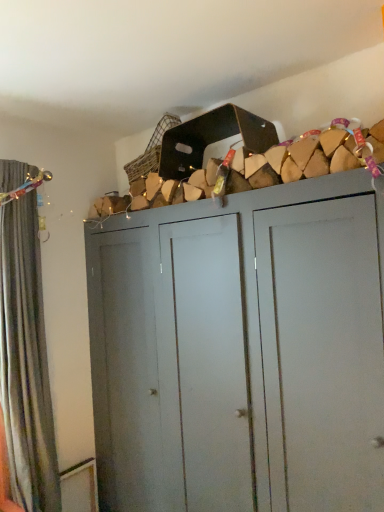
Question: Considering the relative positions of matte gray cupboard at center and velvet dark grey curtain at left in the image provided, is matte gray cupboard at center to the right of velvet dark grey curtain at left from the viewer's perspective?

Choices:
 (A) no
 (B) yes

Answer: (B)

Question: Does matte gray cupboard at center have a greater width compared to velvet dark grey curtain at left?

Choices:
 (A) no
 (B) yes

Answer: (B)

Question: Are matte gray cupboard at center and velvet dark grey curtain at left located far from each other?

Choices:
 (A) yes
 (B) no

Answer: (B)

Question: Are matte gray cupboard at center and velvet dark grey curtain at left making contact?

Choices:
 (A) no
 (B) yes

Answer: (A)

Question: From a real-world perspective, is matte gray cupboard at center below velvet dark grey curtain at left?

Choices:
 (A) no
 (B) yes

Answer: (B)

Question: Considering the relative sizes of matte gray cupboard at center and velvet dark grey curtain at left in the image provided, is matte gray cupboard at center bigger than velvet dark grey curtain at left?

Choices:
 (A) no
 (B) yes

Answer: (B)

Question: Is velvet dark grey curtain at left thinner than matte gray cupboard at center?

Choices:
 (A) no
 (B) yes

Answer: (B)

Question: Can you confirm if velvet dark grey curtain at left is positioned to the right of matte gray cupboard at center?

Choices:
 (A) yes
 (B) no

Answer: (B)

Question: From the image's perspective, is velvet dark grey curtain at left above matte gray cupboard at center?

Choices:
 (A) no
 (B) yes

Answer: (B)

Question: Considering the relative positions of velvet dark grey curtain at left and matte gray cupboard at center in the image provided, is velvet dark grey curtain at left behind matte gray cupboard at center?

Choices:
 (A) no
 (B) yes

Answer: (B)

Question: Is velvet dark grey curtain at left to the left of matte gray cupboard at center from the viewer's perspective?

Choices:
 (A) no
 (B) yes

Answer: (B)

Question: From a real-world perspective, is velvet dark grey curtain at left physically below matte gray cupboard at center?

Choices:
 (A) no
 (B) yes

Answer: (A)

Question: Considering the positions of point (26, 510) and point (233, 486), is point (26, 510) closer or farther from the camera than point (233, 486)?

Choices:
 (A) farther
 (B) closer

Answer: (A)